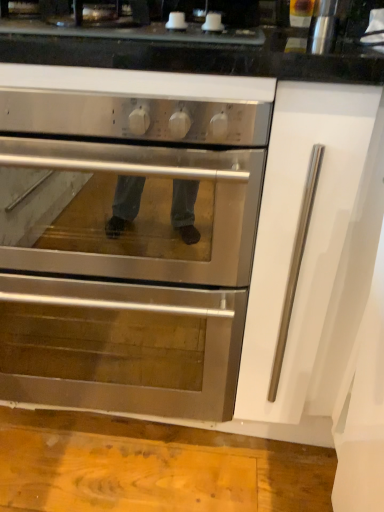
Question: Is stainless steel oven at center bigger or smaller than satin black cooktop at upper center?

Choices:
 (A) small
 (B) big

Answer: (B)

Question: Does point (61, 314) appear closer or farther from the camera than point (221, 50)?

Choices:
 (A) farther
 (B) closer

Answer: (A)

Question: Which object is positioned farthest from the satin black cooktop at upper center?

Choices:
 (A) stainless steel oven at center
 (B) metallic cylindrical container at upper right

Answer: (A)

Question: Estimate the real-world distances between objects in this image. Which object is closer to the stainless steel oven at center?

Choices:
 (A) satin black cooktop at upper center
 (B) metallic cylindrical container at upper right

Answer: (A)